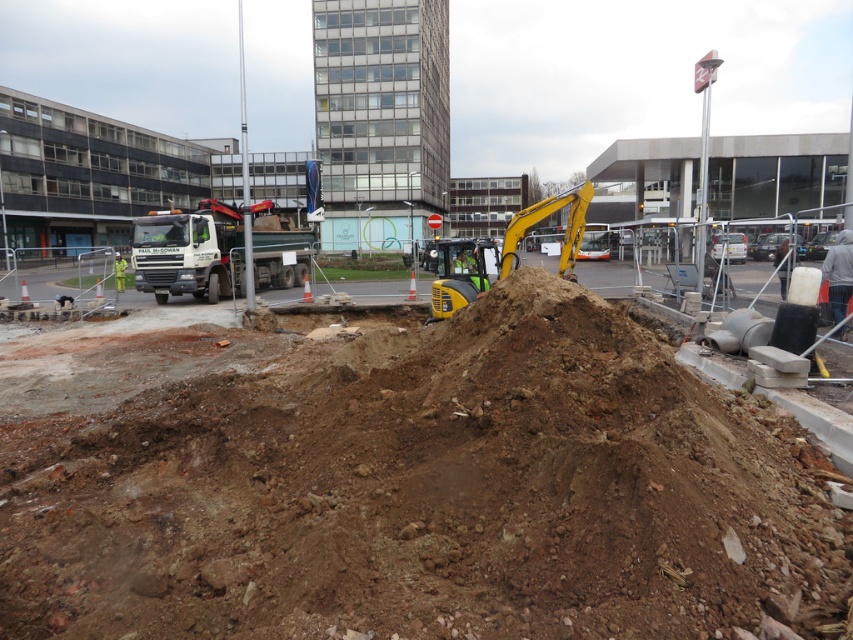
You are a construction worker standing at the point marked by coordinates point (401, 481). What is the terrain like around you?

The point (401, 481) marks brown earth at center, so the terrain around you is brown earth with a rough and uneven texture, as described in the scene.

You are a construction worker who needs to move a heavy object from the brown earth at center to the yellow rubber excavator at center. Based on their positions, which direction should you move the object to reach the excavator?

The brown earth at center is to the left of the yellow rubber excavator at center, so you should move the object to the right to reach the excavator.